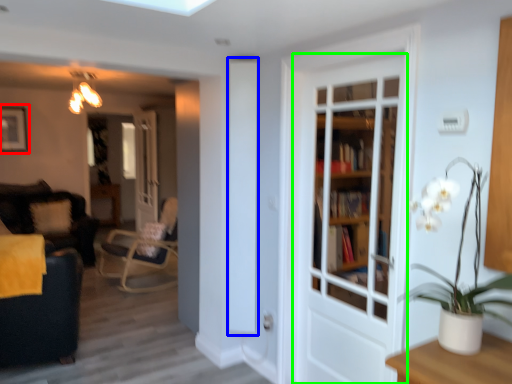
Question: Estimate the real-world distances between objects in this image. Which object is farther from picture frame (highlighted by a red box), screen door (highlighted by a blue box) or door (highlighted by a green box)?

Choices:
 (A) screen door
 (B) door

Answer: (B)